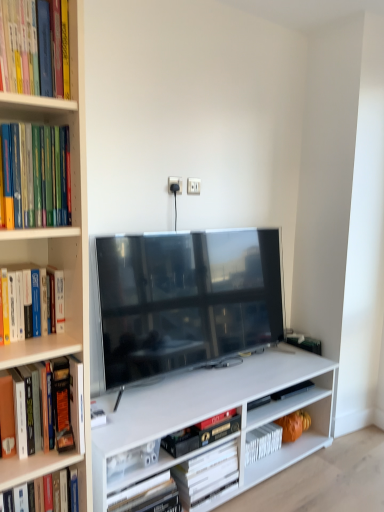
I want to click on vacant region to the right of hardcover book at lower center, the first book from the back, so click(248, 498).